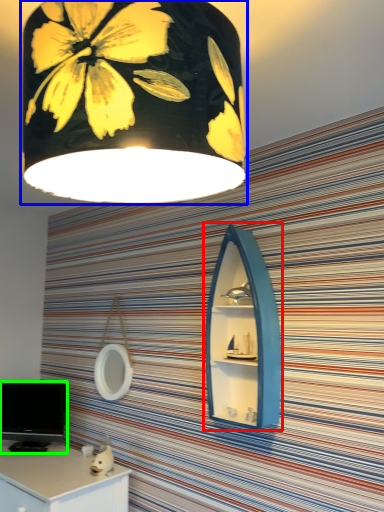
Question: Considering the real-world distances, which object is farthest from medicine cabinet (highlighted by a red box)? lamp (highlighted by a blue box) or computer monitor (highlighted by a green box)?

Choices:
 (A) lamp
 (B) computer monitor

Answer: (B)